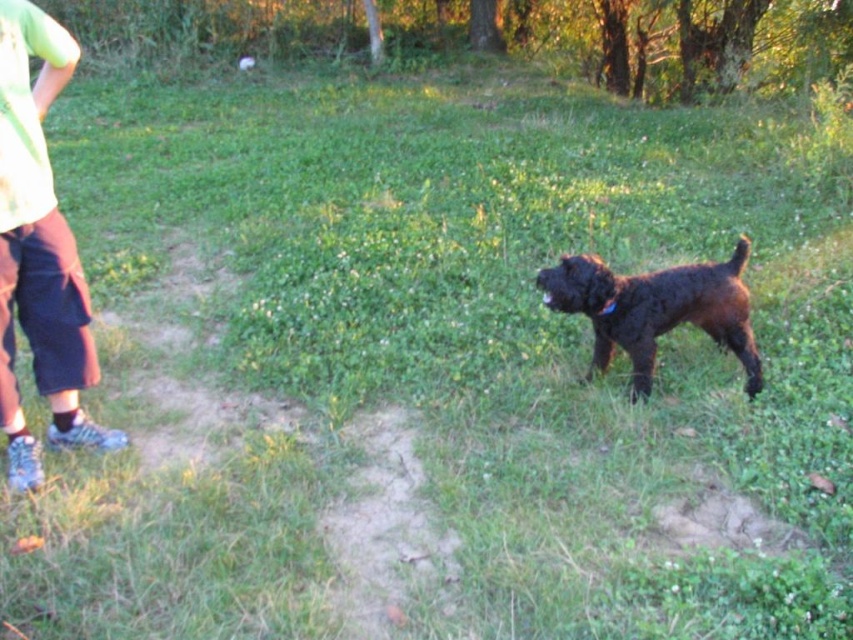
Does light green t-shirt at left appear under wet brown fur dog at center?

No, light green t-shirt at left is not below wet brown fur dog at center.

Which is more to the left, light green t-shirt at left or wet brown fur dog at center?

light green t-shirt at left

You are a GUI agent. You are given a task and a screenshot of the screen. Output one action in this format:
    pyautogui.click(x=<x>, y=<y>)
    Task: Click on the light green t-shirt at left
    
    Given the screenshot: What is the action you would take?
    pyautogui.click(x=39, y=250)